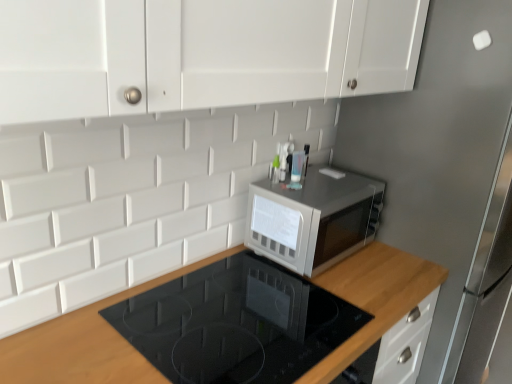
Locate an element on the screen. This screenshot has width=512, height=384. free spot in front of satin silver microwave at center is located at coordinates (315, 295).